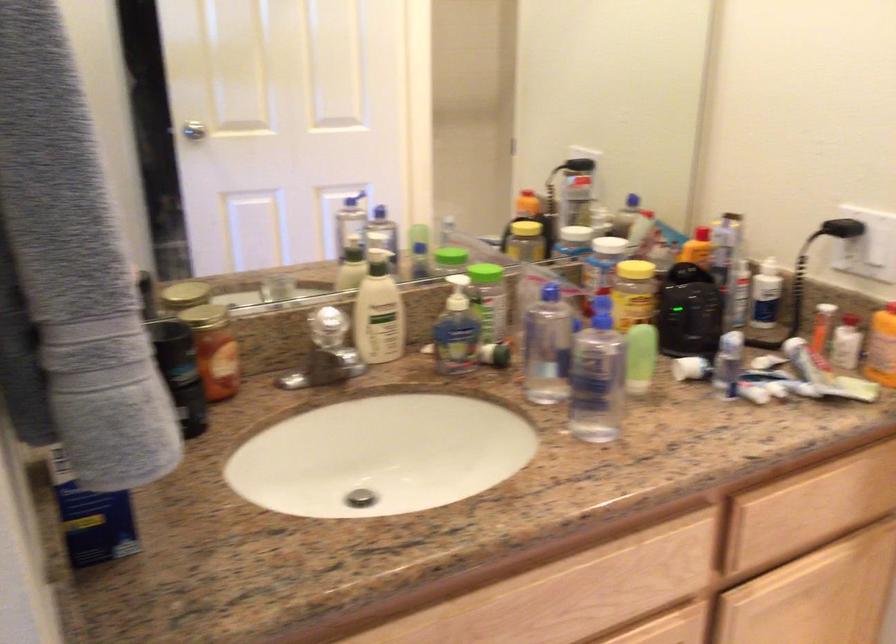
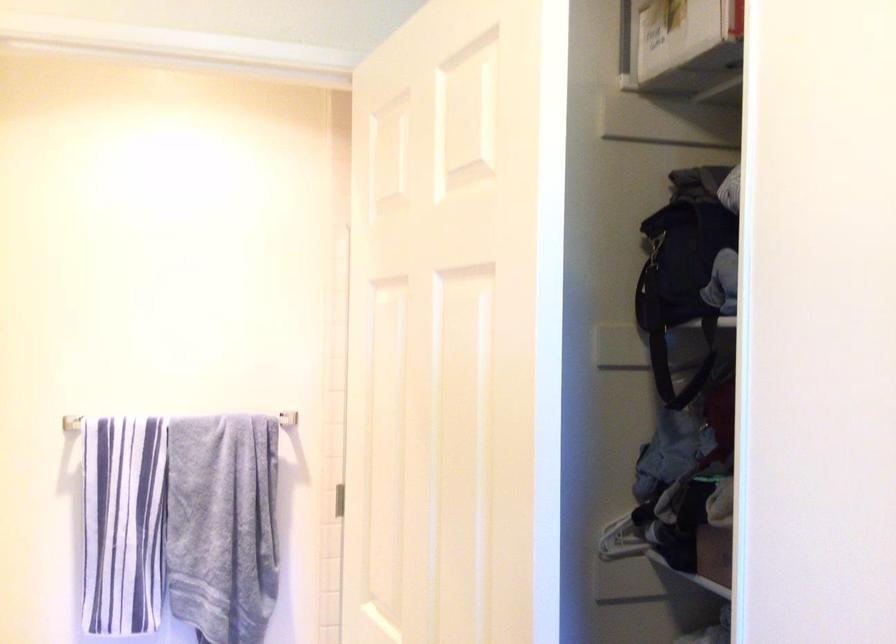
Question: Based on the continuous images, in which direction is the camera rotating? Reply with the corresponding letter.

Choices:
 (A) Left
 (B) Right
 (C) Up
 (D) Down

Answer: (B)